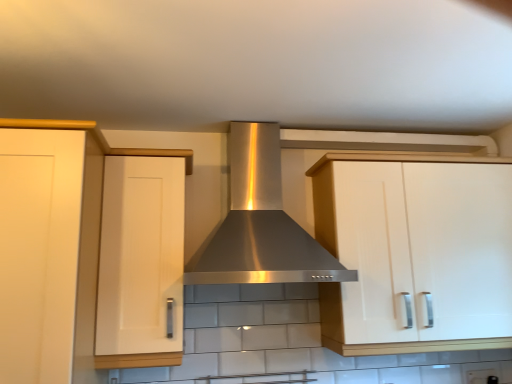
Question: From the image's perspective, is matte white cabinet at left, which is the 3th cabinetry from right to left, on top of white matte cabinet at left, the 2th cabinetry when ordered from left to right?

Choices:
 (A) yes
 (B) no

Answer: (B)

Question: Does matte white cabinet at left, which appears as the 1th cabinetry when viewed from the left, appear on the left side of white matte cabinet at left, the 2th cabinetry when ordered from left to right?

Choices:
 (A) yes
 (B) no

Answer: (A)

Question: Considering the relative sizes of matte white cabinet at left, which appears as the 1th cabinetry when viewed from the left, and white matte cabinet at left, the 2th cabinetry when ordered from left to right, in the image provided, is matte white cabinet at left, which appears as the 1th cabinetry when viewed from the left, wider than white matte cabinet at left, the 2th cabinetry when ordered from left to right,?

Choices:
 (A) yes
 (B) no

Answer: (A)

Question: Is matte white cabinet at left, which is the 3th cabinetry from right to left, positioned with its back to white matte cabinet at left, the 2th cabinetry when ordered from left to right?

Choices:
 (A) no
 (B) yes

Answer: (A)

Question: Considering the relative sizes of matte white cabinet at left, which appears as the 1th cabinetry when viewed from the left, and white matte cabinet at left, the 2th cabinetry when ordered from left to right, in the image provided, is matte white cabinet at left, which appears as the 1th cabinetry when viewed from the left, bigger than white matte cabinet at left, the 2th cabinetry when ordered from left to right,?

Choices:
 (A) no
 (B) yes

Answer: (B)

Question: From a real-world perspective, is matte white cabinet at left, which appears as the 1th cabinetry when viewed from the left, physically located above or below white glossy cabinet at right, positioned as the first cabinetry in right-to-left order?

Choices:
 (A) below
 (B) above

Answer: (A)

Question: From their relative heights in the image, would you say matte white cabinet at left, which appears as the 1th cabinetry when viewed from the left, is taller or shorter than white glossy cabinet at right, the third cabinetry from the left?

Choices:
 (A) short
 (B) tall

Answer: (B)

Question: From the image's perspective, relative to white glossy cabinet at right, positioned as the first cabinetry in right-to-left order, is matte white cabinet at left, which is the 3th cabinetry from right to left, above or below?

Choices:
 (A) below
 (B) above

Answer: (A)

Question: Is point (66, 231) positioned closer to the camera than point (331, 345)?

Choices:
 (A) closer
 (B) farther

Answer: (A)

Question: From the image's perspective, is white matte cabinet at left, the 2th cabinetry positioned from the right, positioned above or below stainless steel range hood at center?

Choices:
 (A) below
 (B) above

Answer: (A)

Question: Looking at the image, does white matte cabinet at left, the 2th cabinetry when ordered from left to right, seem bigger or smaller compared to stainless steel range hood at center?

Choices:
 (A) small
 (B) big

Answer: (A)

Question: Is white matte cabinet at left, the 2th cabinetry when ordered from left to right, inside the boundaries of stainless steel range hood at center, or outside?

Choices:
 (A) inside
 (B) outside

Answer: (B)

Question: Is point (108, 203) closer or farther from the camera than point (240, 215)?

Choices:
 (A) closer
 (B) farther

Answer: (A)

Question: Considering their positions, is stainless steel range hood at center located in front of or behind matte white cabinet at left, which appears as the 1th cabinetry when viewed from the left?

Choices:
 (A) front
 (B) behind

Answer: (B)

Question: Is point (282, 205) positioned closer to the camera than point (68, 172)?

Choices:
 (A) closer
 (B) farther

Answer: (B)